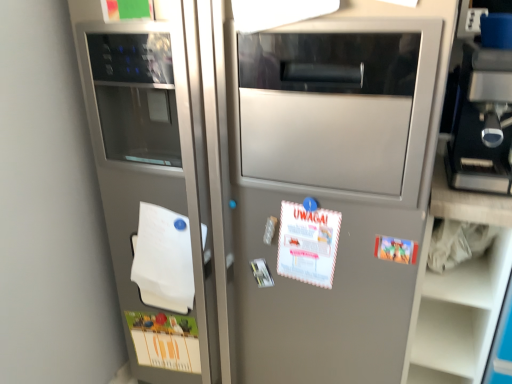
Locate an element on the screen. The image size is (512, 384). black plastic coffee machine at upper right is located at coordinates tap(482, 122).

What do you see at coordinates (308, 244) in the screenshot?
I see `white paper at center, which is counted as the 3th postcard, starting from the bottom` at bounding box center [308, 244].

Find the location of `white matte notepad at left`. white matte notepad at left is located at coordinates (164, 259).

Which of these two, matte paper postcard at lower left, arranged as the first postcard when viewed from the left, or matte plastic postcard at right, arranged as the second postcard when ordered from the bottom, is bigger?

matte paper postcard at lower left, arranged as the first postcard when viewed from the left, is bigger.

Does matte paper postcard at lower left, which is counted as the 1th postcard, starting from the bottom, come in front of matte plastic postcard at right, arranged as the second postcard when ordered from the bottom?

That is False.

Could you measure the distance between matte paper postcard at lower left, the 3th postcard in the right-to-left sequence, and matte plastic postcard at right, arranged as the second postcard when ordered from the bottom?

77.62 centimeters.

Does point (168, 320) come farther from viewer compared to point (410, 241)?

Yes, point (168, 320) is behind point (410, 241).

Considering the relative sizes of matte paper postcard at lower left, acting as the third postcard starting from the front, and white matte notepad at left in the image provided, is matte paper postcard at lower left, acting as the third postcard starting from the front, thinner than white matte notepad at left?

Correct, the width of matte paper postcard at lower left, acting as the third postcard starting from the front, is less than that of white matte notepad at left.

What's the angular difference between matte paper postcard at lower left, the 3th postcard in the right-to-left sequence, and white matte notepad at left's facing directions?

They differ by 4.19 degrees in their facing directions.

Is matte paper postcard at lower left, which is counted as the 1th postcard, starting from the bottom, bigger or smaller than white matte notepad at left?

Considering their sizes, matte paper postcard at lower left, which is counted as the 1th postcard, starting from the bottom, takes up less space than white matte notepad at left.

Is white paper at center, which ranks as the second postcard in right-to-left order, looking in the opposite direction of matte plastic postcard at right, which is the 2th postcard from top to bottom?

No, white paper at center, which ranks as the second postcard in right-to-left order, is not facing the opposite direction of matte plastic postcard at right, which is the 2th postcard from top to bottom.

Can you confirm if white paper at center, the first postcard when ordered from top to bottom, is taller than matte plastic postcard at right, arranged as the second postcard when ordered from the bottom?

Yes, white paper at center, the first postcard when ordered from top to bottom, is taller than matte plastic postcard at right, arranged as the second postcard when ordered from the bottom.

Are white paper at center, the 2th postcard viewed from the back, and matte plastic postcard at right, which is the 2th postcard from top to bottom, located far from each other?

No, white paper at center, the 2th postcard viewed from the back, is not far from matte plastic postcard at right, which is the 2th postcard from top to bottom.

Which is closer to the camera, (327,248) or (400,245)?

Point (327,248) is farther from the camera than point (400,245).

Is black plastic coffee machine at upper right bigger than matte paper postcard at lower left, the 3th postcard in the top-to-bottom sequence?

Yes.

Is black plastic coffee machine at upper right facing away from matte paper postcard at lower left, the 1th postcard when ordered from back to front?

black plastic coffee machine at upper right is not turned away from matte paper postcard at lower left, the 1th postcard when ordered from back to front.

Looking at this image, is black plastic coffee machine at upper right next to matte paper postcard at lower left, acting as the third postcard starting from the front, and touching it?

No, black plastic coffee machine at upper right is not making contact with matte paper postcard at lower left, acting as the third postcard starting from the front.

Is white matte notepad at left positioned in front of matte paper postcard at lower left, which is counted as the 1th postcard, starting from the bottom?

Yes, it is in front of matte paper postcard at lower left, which is counted as the 1th postcard, starting from the bottom.

Would you say white matte notepad at left contains matte paper postcard at lower left, which is counted as the 1th postcard, starting from the bottom?

No.

Is there a large distance between white matte notepad at left and matte paper postcard at lower left, acting as the third postcard starting from the front?

No, white matte notepad at left is in close proximity to matte paper postcard at lower left, acting as the third postcard starting from the front.

Image resolution: width=512 pixels, height=384 pixels. What are the coordinates of `notepad on the right of matte paper postcard at lower left, the 3th postcard in the right-to-left sequence` in the screenshot? It's located at (164, 259).

Considering the relative sizes of white matte notepad at left and black plastic coffee machine at upper right in the image provided, is white matte notepad at left taller than black plastic coffee machine at upper right?

In fact, white matte notepad at left may be shorter than black plastic coffee machine at upper right.

Between white matte notepad at left and black plastic coffee machine at upper right, which one has larger width?

With larger width is black plastic coffee machine at upper right.

From a real-world perspective, between white matte notepad at left and black plastic coffee machine at upper right, who is vertically lower?

white matte notepad at left is physically lower.

Relative to black plastic coffee machine at upper right, is white matte notepad at left in front or behind?

Clearly, white matte notepad at left is behind black plastic coffee machine at upper right.

Is matte paper postcard at lower left, the 3th postcard in the right-to-left sequence, turned away from white paper at center, which is counted as the 3th postcard, starting from the bottom?

No, matte paper postcard at lower left, the 3th postcard in the right-to-left sequence, is not facing the opposite direction of white paper at center, which is counted as the 3th postcard, starting from the bottom.

Between matte paper postcard at lower left, arranged as the first postcard when viewed from the left, and white paper at center, the first postcard when ordered from top to bottom, which one has less height?

With less height is white paper at center, the first postcard when ordered from top to bottom.

Looking at this image, from the image's perspective, is matte paper postcard at lower left, arranged as the first postcard when viewed from the left, located beneath white paper at center, the second postcard viewed from the front?

Correct, matte paper postcard at lower left, arranged as the first postcard when viewed from the left, appears lower than white paper at center, the second postcard viewed from the front, in the image.

In order to click on postcard below the matte plastic postcard at right, positioned as the 3th postcard in left-to-right order (from the image's perspective) in this screenshot , I will do `click(165, 341)`.

The height and width of the screenshot is (384, 512). I want to click on postcard to the left of white matte notepad at left, so click(165, 341).

Looking at the image, which one is located closer to white matte notepad at left, matte paper postcard at lower left, acting as the third postcard starting from the front, or black plastic coffee machine at upper right?

matte paper postcard at lower left, acting as the third postcard starting from the front, is positioned closer to the anchor white matte notepad at left.

From the image, which object appears to be nearer to black plastic coffee machine at upper right, matte paper postcard at lower left, the 3th postcard in the right-to-left sequence, or white matte notepad at left?

Among the two, white matte notepad at left is located nearer to black plastic coffee machine at upper right.

In the scene shown: Considering their positions, is black plastic coffee machine at upper right positioned closer to matte paper postcard at lower left, the 3th postcard in the top-to-bottom sequence, than matte plastic postcard at right, marked as the first postcard in a front-to-back arrangement?

Based on the image, matte plastic postcard at right, marked as the first postcard in a front-to-back arrangement, appears to be nearer to matte paper postcard at lower left, the 3th postcard in the top-to-bottom sequence.

From the image, which object appears to be farther from white matte notepad at left, black plastic coffee machine at upper right or white paper at center, which ranks as the second postcard in right-to-left order?

The object further to white matte notepad at left is black plastic coffee machine at upper right.

Looking at the image, which one is located closer to matte paper postcard at lower left, the 1th postcard when ordered from back to front, white paper at center, the 2th postcard viewed from the back, or matte plastic postcard at right, positioned as the 3th postcard in left-to-right order?

Among the two, white paper at center, the 2th postcard viewed from the back, is located nearer to matte paper postcard at lower left, the 1th postcard when ordered from back to front.

Estimate the real-world distances between objects in this image. Which object is closer to black plastic coffee machine at upper right, matte plastic postcard at right, which is the 2th postcard from top to bottom, or white paper at center, the 2th postcard viewed from the back?

matte plastic postcard at right, which is the 2th postcard from top to bottom, is positioned closer to the anchor black plastic coffee machine at upper right.

Looking at the image, which one is located closer to white paper at center, which is counted as the 3th postcard, starting from the bottom, matte paper postcard at lower left, arranged as the first postcard when viewed from the left, or black plastic coffee machine at upper right?

black plastic coffee machine at upper right lies closer to white paper at center, which is counted as the 3th postcard, starting from the bottom, than the other object.

Considering their positions, is white paper at center, which ranks as the second postcard in right-to-left order, positioned closer to matte paper postcard at lower left, the 3th postcard in the right-to-left sequence, than black plastic coffee machine at upper right?

white paper at center, which ranks as the second postcard in right-to-left order, is closer to matte paper postcard at lower left, the 3th postcard in the right-to-left sequence.

Identify the location of postcard situated between matte paper postcard at lower left, the 1th postcard when ordered from back to front, and matte plastic postcard at right, which is the 2th postcard from top to bottom, from left to right. (308, 244).

You are a GUI agent. You are given a task and a screenshot of the screen. Output one action in this format:
    pyautogui.click(x=<x>, y=<y>)
    Task: Click on the postcard between white matte notepad at left and matte plastic postcard at right, marked as the first postcard in a front-to-back arrangement, from left to right
    
    Given the screenshot: What is the action you would take?
    pyautogui.click(x=308, y=244)

Locate an element on the screen. The image size is (512, 384). notepad between matte paper postcard at lower left, acting as the third postcard starting from the front, and matte plastic postcard at right, positioned as the 3th postcard in left-to-right order, from left to right is located at coordinates (164, 259).

Locate an element on the screen. This screenshot has width=512, height=384. notepad between matte paper postcard at lower left, the 3th postcard in the right-to-left sequence, and black plastic coffee machine at upper right, in the horizontal direction is located at coordinates (164, 259).